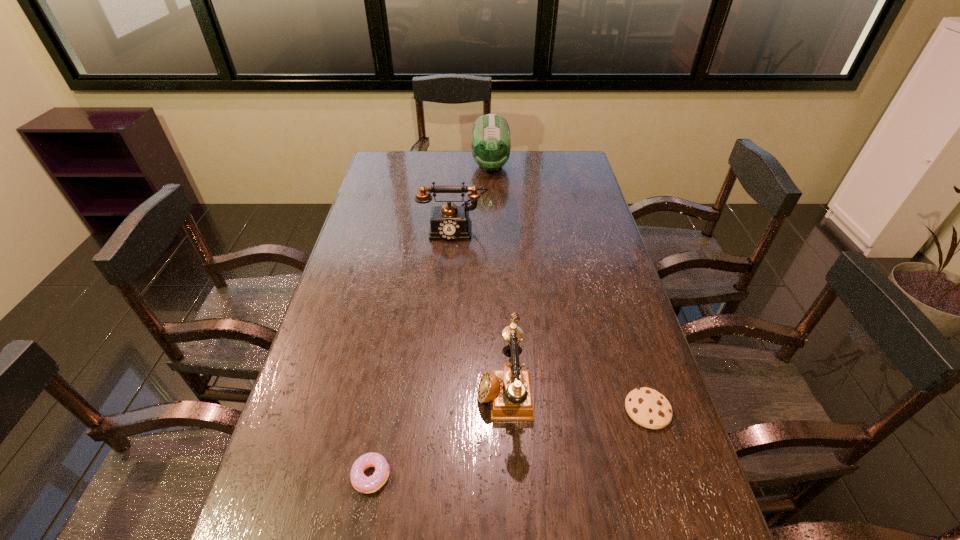
Where is `unoccupied position between the football helmet and the nearer telephone`? The image size is (960, 540). unoccupied position between the football helmet and the nearer telephone is located at coordinates pyautogui.click(x=497, y=277).

The width and height of the screenshot is (960, 540). Identify the location of vacant region between the nearer telephone and the nearest object. (438, 431).

Locate an element on the screen. The height and width of the screenshot is (540, 960). vacant area between the football helmet and the doughnut is located at coordinates (431, 321).

The image size is (960, 540). I want to click on free space between the rightmost object and the nearer telephone, so click(x=576, y=399).

This screenshot has width=960, height=540. Find the location of `free spot between the nearer telephone and the cookie`. free spot between the nearer telephone and the cookie is located at coordinates 576,399.

Where is `empty space between the farthest object and the doughnut`? Image resolution: width=960 pixels, height=540 pixels. empty space between the farthest object and the doughnut is located at coordinates (431, 321).

This screenshot has width=960, height=540. Find the location of `empty location between the nearest object and the fourth nearest object`. empty location between the nearest object and the fourth nearest object is located at coordinates (412, 352).

Locate which object is the closest to the second farthest object. Please provide its 2D coordinates. Your answer should be formatted as a tuple, i.e. [(x, y)], where the tuple contains the x and y coordinates of a point satisfying the conditions above.

[(491, 140)]

Find the location of a particular element. object that stands as the closest to the second farthest object is located at coordinates (491, 140).

Identify the location of vacant space that satisfies the following two spatial constraints: 1. on the front of the fourth nearest object at the rotary dial; 2. on the left side of the rightmost object. (440, 410).